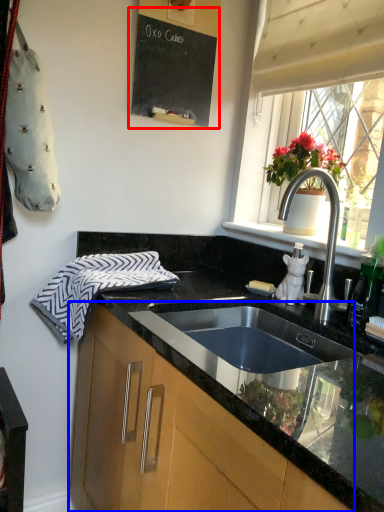
Question: Which object is further to the camera taking this photo, bulletin board (highlighted by a red box) or cabinetry (highlighted by a blue box)?

Choices:
 (A) bulletin board
 (B) cabinetry

Answer: (A)